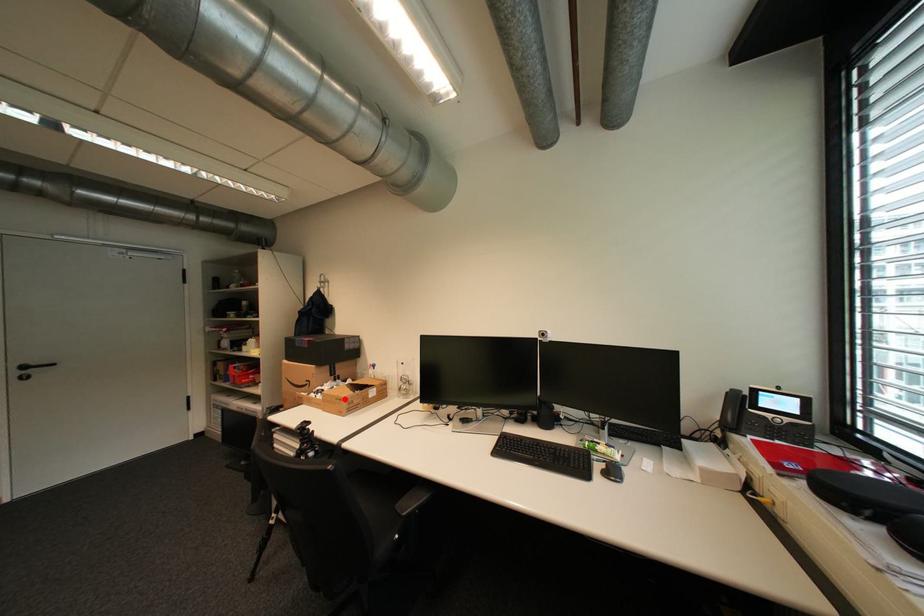
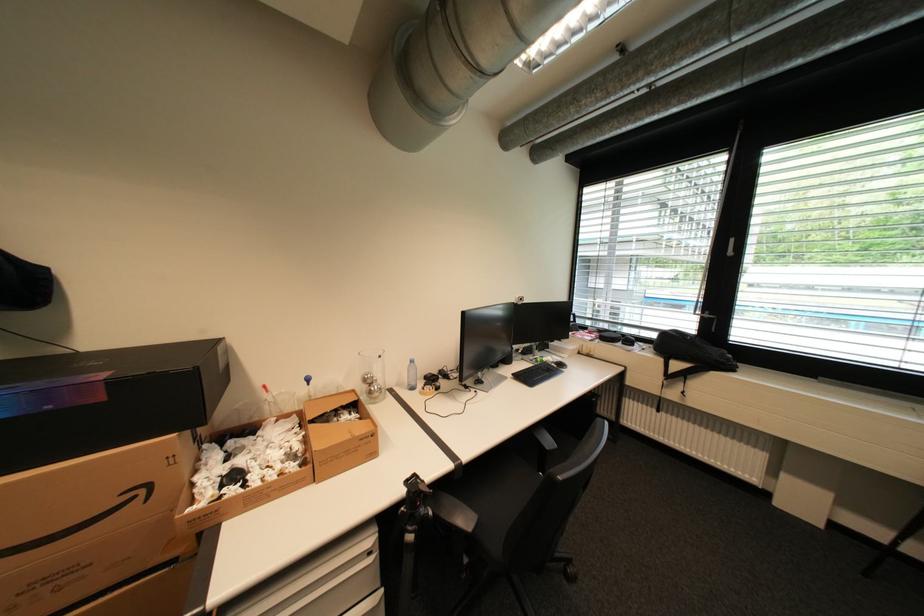
Find the pixel in the second image that matches the highlighted location in the first image.

(370, 440)